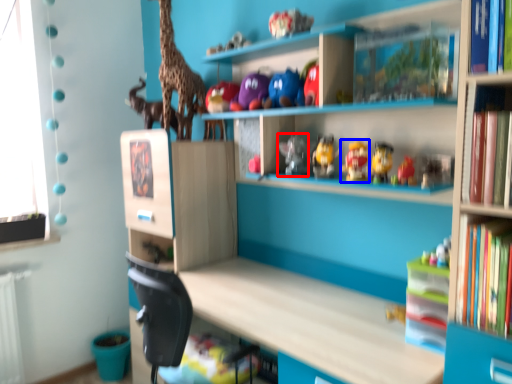
Question: Which object appears farthest to the camera in this image, toy (highlighted by a red box) or toy (highlighted by a blue box)?

Choices:
 (A) toy
 (B) toy

Answer: (A)